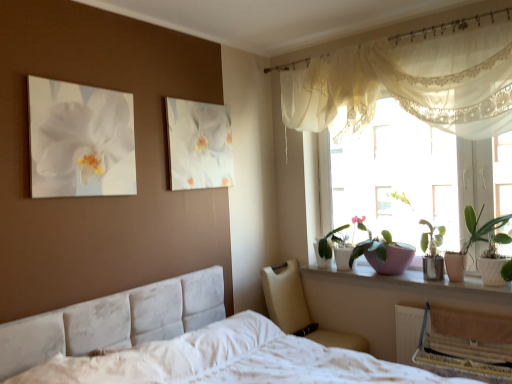
This screenshot has height=384, width=512. What do you see at coordinates (409, 84) in the screenshot? I see `sheer white curtain at upper right` at bounding box center [409, 84].

What is the approximate width of beige fabric armchair at lower center?

The width of beige fabric armchair at lower center is 25.46 inches.

Describe the element at coordinates (228, 360) in the screenshot. This screenshot has width=512, height=384. I see `white fabric bed at lower center` at that location.

What do you see at coordinates (332, 242) in the screenshot? I see `green glossy leafy plant at window, positioned as the 2th houseplant in right-to-left order` at bounding box center [332, 242].

Describe the element at coordinates (198, 145) in the screenshot. I see `white glossy canvas at upper center` at that location.

Where is `translucent fabric at upper right`? translucent fabric at upper right is located at coordinates (405, 178).

Is white fabric bed at lower center situated inside white glossy orchid at upper left or outside?

white fabric bed at lower center is not inside white glossy orchid at upper left, it's outside.

Can you confirm if white fabric bed at lower center is positioned to the right of white glossy orchid at upper left?

Indeed, white fabric bed at lower center is positioned on the right side of white glossy orchid at upper left.

Are white fabric bed at lower center and white glossy orchid at upper left located far from each other?

Yes, white fabric bed at lower center and white glossy orchid at upper left are quite far apart.

At what (x,y) coordinates should I click in order to perform the action: click on flower above the white fabric bed at lower center (from the image's perspective). Please return your answer as a coordinate pair (x, y). Looking at the image, I should click on (84, 136).

Do you think green glossy plant at right, the second houseplant viewed from the left, is within sheer white curtain at upper right, or outside of it?

green glossy plant at right, the second houseplant viewed from the left, is outside sheer white curtain at upper right.

This screenshot has height=384, width=512. In order to click on curtain above the green glossy plant at right, the 1th houseplant in the front-to-back sequence (from a real-world perspective) in this screenshot , I will do (x=409, y=84).

How many degrees apart are the facing directions of green glossy plant at right, the 1th houseplant in the front-to-back sequence, and sheer white curtain at upper right?

They differ by 0.863 degrees in their facing directions.

Does green glossy plant at right, the second houseplant viewed from the left, turn towards sheer white curtain at upper right?

No, green glossy plant at right, the second houseplant viewed from the left, is not turned towards sheer white curtain at upper right.

Are sheer white curtain at upper right and white glossy bowl at upper right beside each other?

No, sheer white curtain at upper right is not next to white glossy bowl at upper right.

Is sheer white curtain at upper right thinner than white glossy bowl at upper right?

Correct, the width of sheer white curtain at upper right is less than that of white glossy bowl at upper right.

How much distance is there between sheer white curtain at upper right and white glossy bowl at upper right?

The distance of sheer white curtain at upper right from white glossy bowl at upper right is 3.80 feet.

Can you confirm if sheer white curtain at upper right is smaller than white glossy bowl at upper right?

No, sheer white curtain at upper right is not smaller than white glossy bowl at upper right.

Looking at this image, which is closer, [175,362] or [347,263]?

Point [175,362] appears to be closer to the viewer than point [347,263].

Is white fabric bed at lower center smaller than green glossy leafy plant at window, positioned as the 2th houseplant in right-to-left order?

Actually, white fabric bed at lower center might be larger than green glossy leafy plant at window, positioned as the 2th houseplant in right-to-left order.

Is white fabric bed at lower center turned away from green glossy leafy plant at window, positioned as the 2th houseplant in right-to-left order?

That's not correct — white fabric bed at lower center is not looking away from green glossy leafy plant at window, positioned as the 2th houseplant in right-to-left order.

From a real-world perspective, is white fabric bed at lower center on green glossy leafy plant at window, which ranks as the 2th houseplant in front-to-back order?

No.

Can you confirm if green glossy leafy plant at window, acting as the first houseplant starting from the left, is smaller than white glossy bowl at upper right?

Actually, green glossy leafy plant at window, acting as the first houseplant starting from the left, might be larger than white glossy bowl at upper right.

Where is `window sill on the right of the green glossy leafy plant at window, positioned as the 2th houseplant in right-to-left order`? This screenshot has height=384, width=512. window sill on the right of the green glossy leafy plant at window, positioned as the 2th houseplant in right-to-left order is located at coordinates (418, 284).

Based on the photo, considering the sizes of objects green glossy leafy plant at window, which ranks as the 2th houseplant in front-to-back order, and white glossy bowl at upper right in the image provided, who is wider, green glossy leafy plant at window, which ranks as the 2th houseplant in front-to-back order, or white glossy bowl at upper right?

white glossy bowl at upper right.

Is green glossy leafy plant at window, acting as the first houseplant starting from the left, aimed at white glossy bowl at upper right?

No.

Which object is further away from the camera taking this photo, pink matte pot at window or white glossy canvas at upper center?

pink matte pot at window.

Is pink matte pot at window shorter than white glossy canvas at upper center?

Yes.

Which is less distant, (380,244) or (168,145)?

Point (168,145)

From the image's perspective, is pink matte pot at window on top of white glossy canvas at upper center?

Incorrect, from the image's perspective, pink matte pot at window is lower than white glossy canvas at upper center.

Based on the photo, does pink matte pot at window appear on the left side of white glossy bowl at upper right?

Indeed, pink matte pot at window is positioned on the left side of white glossy bowl at upper right.

Is white glossy bowl at upper right at the back of pink matte pot at window?

No, pink matte pot at window is not facing the opposite direction of white glossy bowl at upper right.

Is pink matte pot at window not inside white glossy bowl at upper right?

Yes.

Can you confirm if pink matte pot at window is thinner than white glossy bowl at upper right?

Yes.

Identify the location of flower above the white fabric bed at lower center (from a real-world perspective). (84, 136).

Where is `curtain that is above the green glossy plant at right, the first houseplant from the right (from the image's perspective)`? The height and width of the screenshot is (384, 512). curtain that is above the green glossy plant at right, the first houseplant from the right (from the image's perspective) is located at coordinates pyautogui.click(x=409, y=84).

When comparing their distances from beige fabric armchair at lower center, does white glossy bowl at upper right or pink matte pot at window seem closer?

white glossy bowl at upper right is positioned closer to the anchor beige fabric armchair at lower center.

Estimate the real-world distances between objects in this image. Which object is further from translucent fabric at upper right, white fabric bed at lower center or beige fabric armchair at lower center?

The object further to translucent fabric at upper right is white fabric bed at lower center.

Considering their positions, is translucent fabric at upper right positioned closer to pink matte pot at window than white glossy bowl at upper right?

Based on the image, white glossy bowl at upper right appears to be nearer to pink matte pot at window.

Which object lies nearer to the anchor point pink matte pot at window, green glossy leafy plant at window, which ranks as the 2th houseplant in front-to-back order, or translucent fabric at upper right?

The object closer to pink matte pot at window is green glossy leafy plant at window, which ranks as the 2th houseplant in front-to-back order.

Considering their positions, is pink matte pot at window positioned closer to white glossy orchid at upper left than white fabric bed at lower center?

Based on the image, white fabric bed at lower center appears to be nearer to white glossy orchid at upper left.

Looking at the image, which one is located closer to white fabric bed at lower center, green glossy plant at right, which is counted as the second houseplant, starting from the back, or pink matte pot at window?

Among the two, pink matte pot at window is located nearer to white fabric bed at lower center.

Estimate the real-world distances between objects in this image. Which object is closer to white glossy canvas at upper center, white glossy bowl at upper right or beige fabric armchair at lower center?

The object closer to white glossy canvas at upper center is beige fabric armchair at lower center.

When comparing their distances from green glossy plant at right, the second houseplant viewed from the left, does pink matte pot at window or white glossy canvas at upper center seem closer?

Based on the image, pink matte pot at window appears to be nearer to green glossy plant at right, the second houseplant viewed from the left.

The image size is (512, 384). In order to click on window sill between white glossy orchid at upper left and translucent fabric at upper right from left to right in this screenshot , I will do `click(418, 284)`.

Identify the location of houseplant located between white glossy canvas at upper center and white glossy bowl at upper right in the left-right direction. (332, 242).

Locate an element on the screen. The height and width of the screenshot is (384, 512). armchair located between white glossy canvas at upper center and pink matte pot at window in the left-right direction is located at coordinates (298, 309).

Image resolution: width=512 pixels, height=384 pixels. Identify the location of plant positioned between white fabric bed at lower center and green glossy leafy plant at window, the 1th houseplant from the back, from near to far. (383, 252).